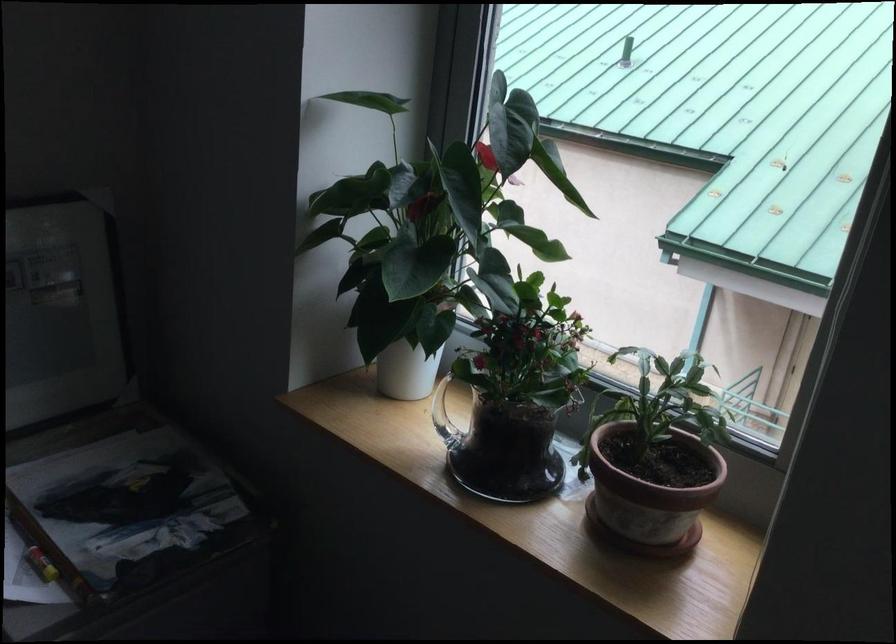
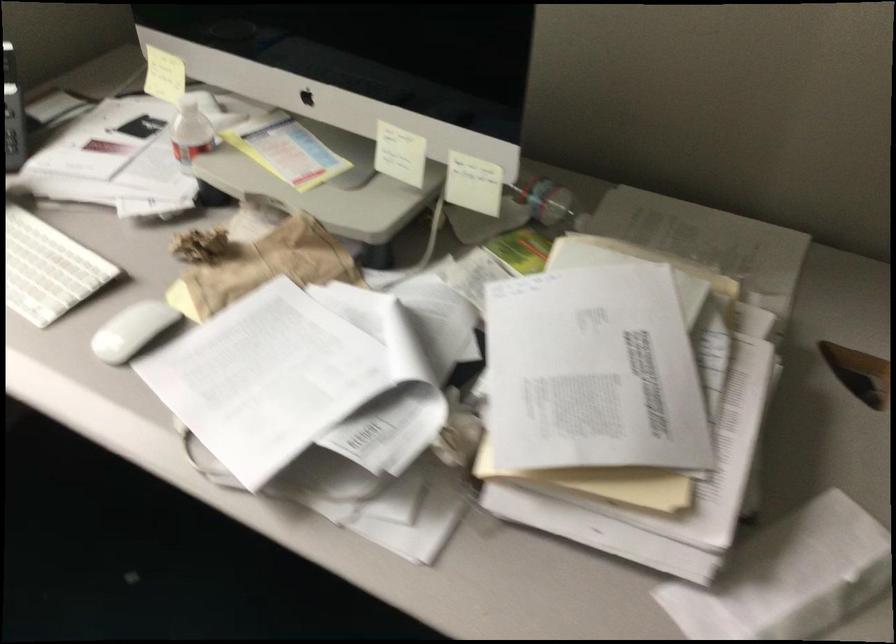
Based on the continuous images, in which direction is the camera rotating?

The camera's rotation is toward right-down.